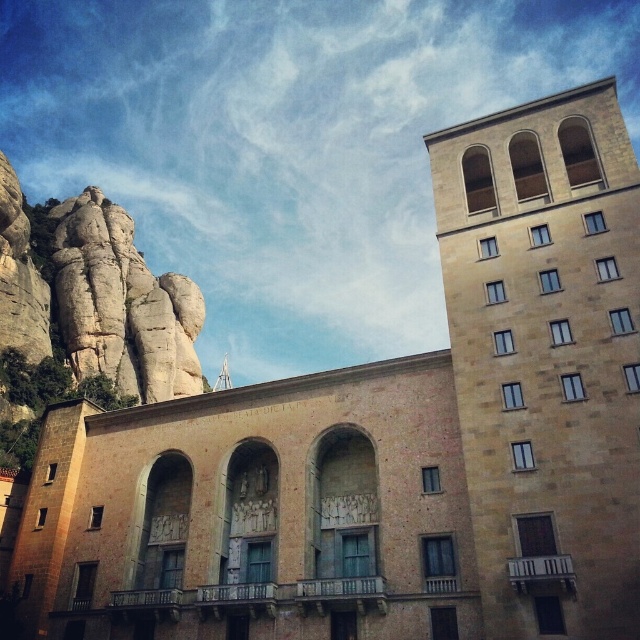
Does brown stone tower at upper right appear under light beige stone rock formation at upper left?

Yes.

What do you see at coordinates (547, 356) in the screenshot?
I see `brown stone tower at upper right` at bounding box center [547, 356].

I want to click on brown stone tower at upper right, so point(547,356).